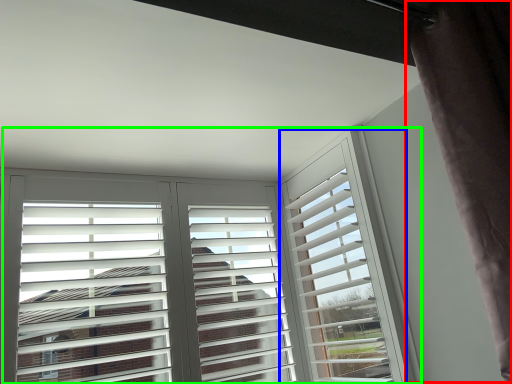
Question: Estimate the real-world distances between objects in this image. Which object is farther from curtain (highlighted by a red box), window frame (highlighted by a blue box) or window (highlighted by a green box)?

Choices:
 (A) window frame
 (B) window

Answer: (B)